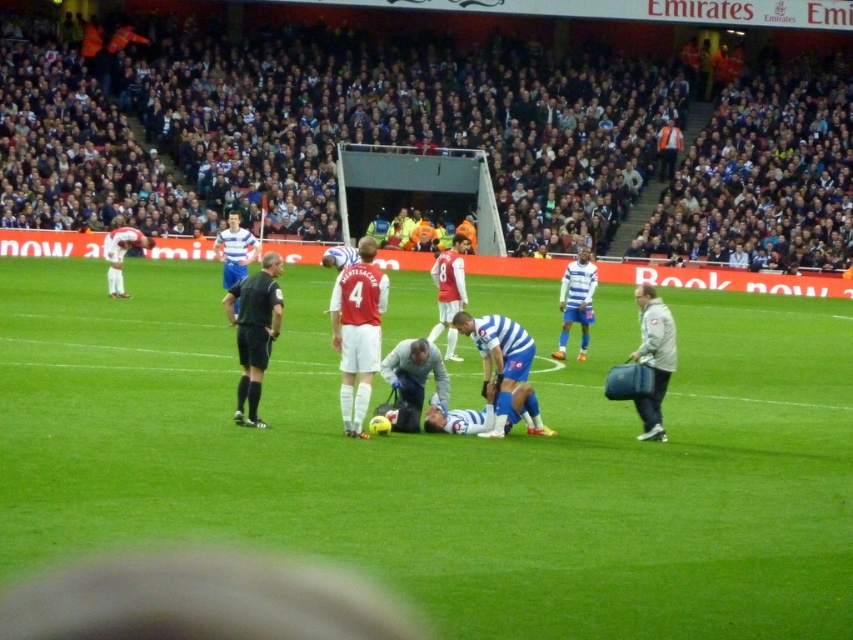
Who is positioned more to the left, black uniform at center or gray fabric bag at center?

Positioned to the left is black uniform at center.

Is black uniform at center to the right of gray fabric bag at center from the viewer's perspective?

No, black uniform at center is not to the right of gray fabric bag at center.

Between point (234, 317) and point (431, 365), which one is positioned behind?

Positioned behind is point (234, 317).

This screenshot has height=640, width=853. I want to click on black uniform at center, so click(254, 330).

Who is positioned more to the left, green grass field at center or white matte jersey at center?

From the viewer's perspective, white matte jersey at center appears more on the left side.

Does green grass field at center have a smaller size compared to white matte jersey at center?

Incorrect, green grass field at center is not smaller in size than white matte jersey at center.

Which is in front, point (659, 490) or point (349, 371)?

Point (659, 490) is more forward.

Where is `green grass field at center`? This screenshot has height=640, width=853. green grass field at center is located at coordinates (445, 458).

Does gray fabric bag at center have a larger size compared to blue fabric player at center?

Incorrect, gray fabric bag at center is not larger than blue fabric player at center.

Which is in front, point (418, 352) or point (578, 316)?

Point (418, 352) is more forward.

Is point (393, 369) positioned after point (582, 317)?

No.

I want to click on gray fabric bag at center, so click(x=412, y=380).